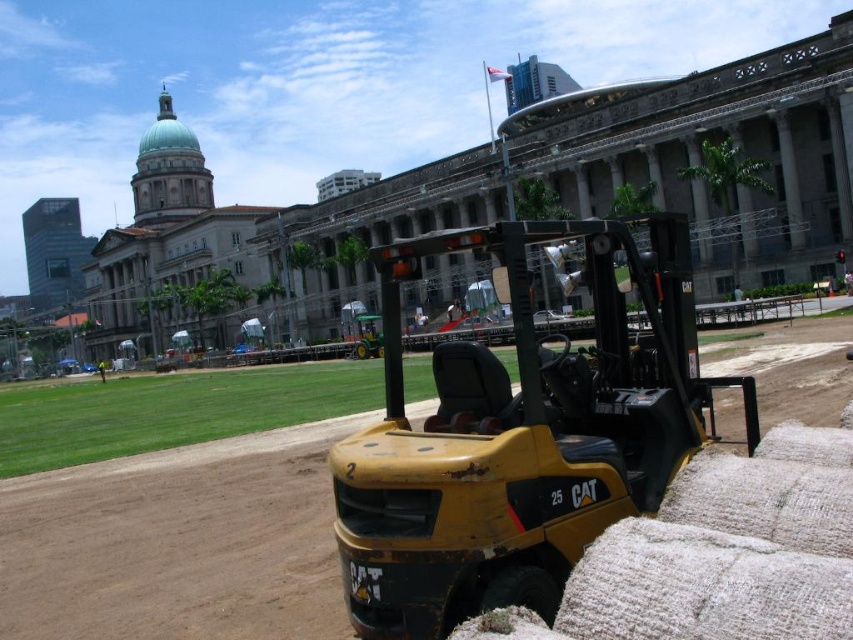
Question: Observing the image, what is the correct spatial positioning of yellow metallic excavator at center in reference to brown dirt track at center?

Choices:
 (A) right
 (B) left

Answer: (B)

Question: Which object appears farthest from the camera in this image?

Choices:
 (A) brown dirt track at center
 (B) yellow metallic excavator at center

Answer: (A)

Question: Can you confirm if yellow metallic excavator at center is wider than brown dirt track at center?

Choices:
 (A) yes
 (B) no

Answer: (B)

Question: Which point is closer to the camera taking this photo?

Choices:
 (A) (160, 518)
 (B) (544, 568)

Answer: (B)

Question: From the image, what is the correct spatial relationship of yellow metallic excavator at center in relation to brown dirt track at center?

Choices:
 (A) right
 (B) left

Answer: (B)